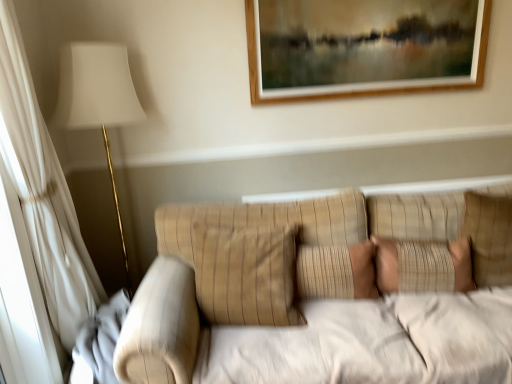
Question: Would you say beige striped pillow at center, the first pillow positioned from the left, is to the left or to the right of beige textured pillow at right, acting as the 3th pillow starting from the left, in the picture?

Choices:
 (A) left
 (B) right

Answer: (A)

Question: Is beige striped pillow at center, positioned as the third pillow in right-to-left order, taller or shorter than beige textured pillow at right, which is counted as the 1th pillow, starting from the right?

Choices:
 (A) tall
 (B) short

Answer: (A)

Question: Considering the real-world distances, which object is farthest from the beige textured pillow at right, which is counted as the 1th pillow, starting from the right?

Choices:
 (A) beige textured pillow at center, which is counted as the 2th pillow, starting from the right
 (B) beige striped pillow at center, the first pillow positioned from the left

Answer: (B)

Question: Estimate the real-world distances between objects in this image. Which object is farther from the beige textured pillow at right, which is counted as the 1th pillow, starting from the right?

Choices:
 (A) beige striped pillow at center, positioned as the third pillow in right-to-left order
 (B) beige textured pillow at center, arranged as the second pillow when viewed from the left

Answer: (A)